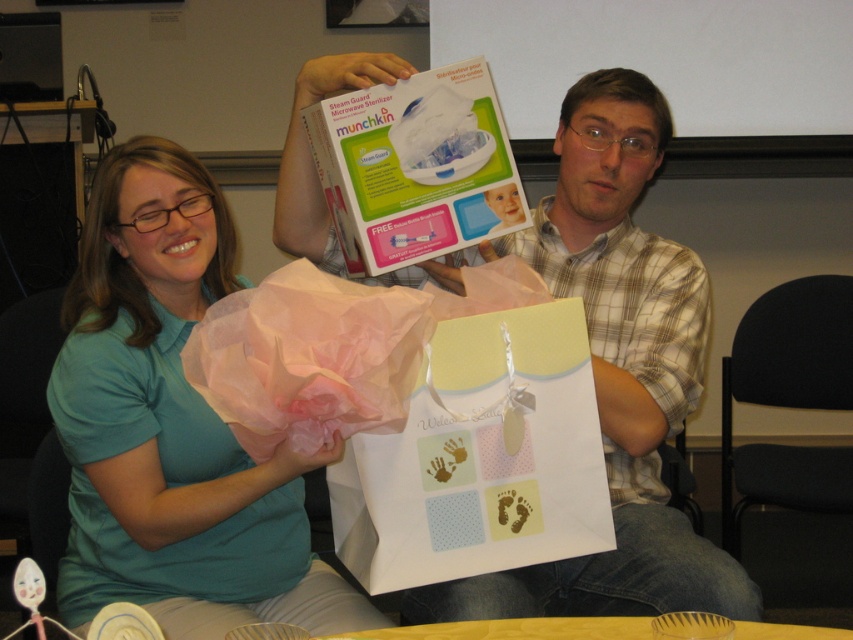
Is teal fabric shirt at center bigger than plaid shirt at center?

No, teal fabric shirt at center is not bigger than plaid shirt at center.

Describe the element at coordinates (172, 426) in the screenshot. I see `teal fabric shirt at center` at that location.

Measure the distance between point (276, 464) and camera.

Point (276, 464) and camera are 3.84 feet apart from each other.

You are a GUI agent. You are given a task and a screenshot of the screen. Output one action in this format:
    pyautogui.click(x=<x>, y=<y>)
    Task: Click on the teal fabric shirt at center
    The width and height of the screenshot is (853, 640).
    Given the screenshot: What is the action you would take?
    pyautogui.click(x=172, y=426)